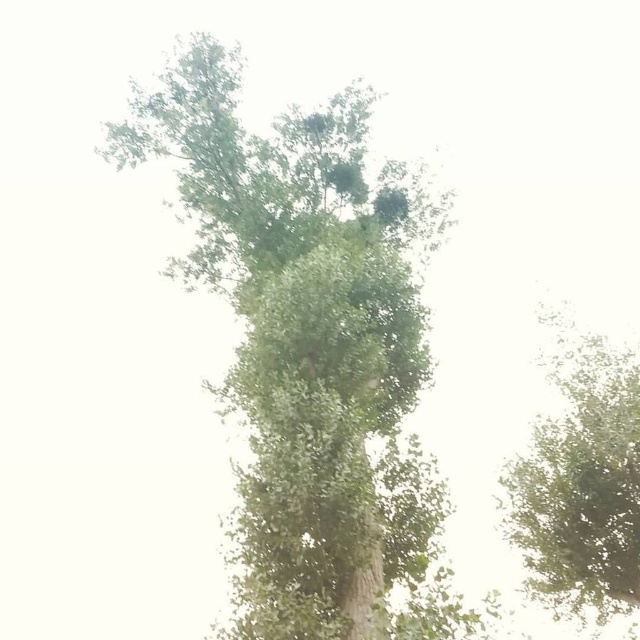
Is point (300, 602) farther from viewer compared to point (570, 380)?

No.

Which is in front, point (435, 496) or point (596, 428)?

Positioned in front is point (435, 496).

Which is in front, point (301, 449) or point (605, 589)?

Point (301, 449)

Where is `green leafy tree at center`? This screenshot has height=640, width=640. green leafy tree at center is located at coordinates (310, 352).